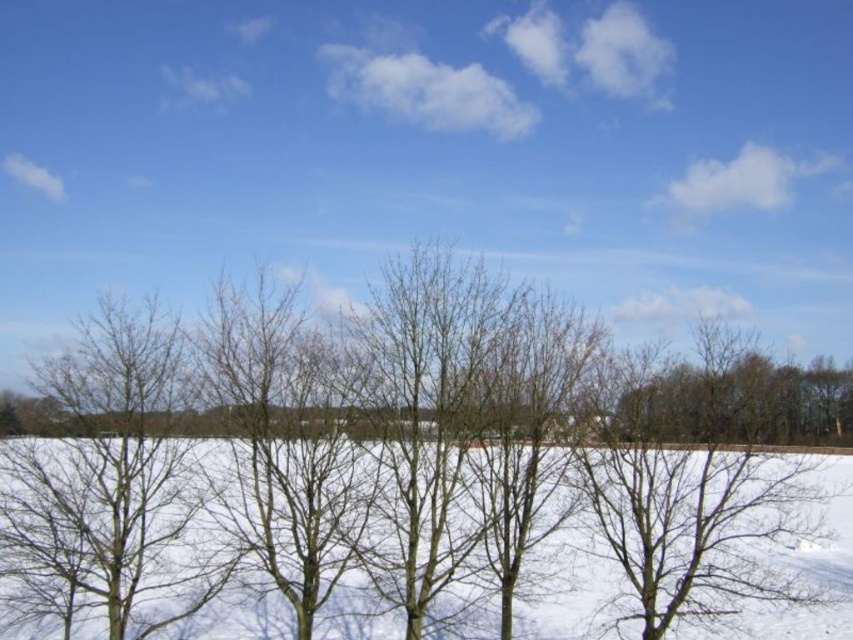
Which is above, bare branches at left or white powdery snow at center?

bare branches at left

Who is shorter, bare branches at left or white powdery snow at center?

With less height is white powdery snow at center.

Is point (108, 420) farther from viewer compared to point (791, 547)?

No, it is in front of (791, 547).

Find the location of a particular element. bare branches at left is located at coordinates (107, 474).